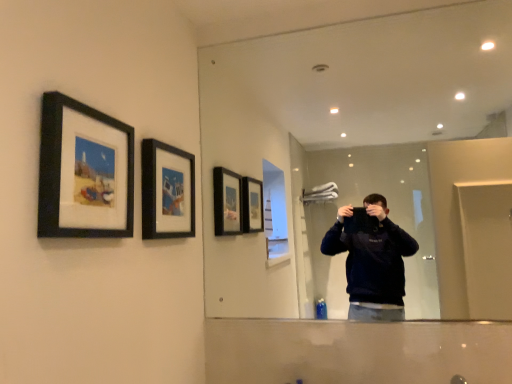
Measure the distance between point (91, 125) and camera.

Point (91, 125) is 1.00 meters from camera.

Where is `black matte picture frame at upper center, which ranks as the 2th picture frame in left-to-right order`? The width and height of the screenshot is (512, 384). black matte picture frame at upper center, which ranks as the 2th picture frame in left-to-right order is located at coordinates (167, 191).

At what (x,y) coordinates should I click in order to perform the action: click on clear glass mirror at upper center. Please return your answer as a coordinate pair (x, y). Looking at the image, I should click on coord(345,142).

Considering the positions of objects black matte picture frame at upper left, which is counted as the 1th picture frame, starting from the front, and clear glass mirror at upper center in the image provided, who is more to the left, black matte picture frame at upper left, which is counted as the 1th picture frame, starting from the front, or clear glass mirror at upper center?

From the viewer's perspective, black matte picture frame at upper left, which is counted as the 1th picture frame, starting from the front, appears more on the left side.

From the image's perspective, is black matte picture frame at upper left, which appears as the 2th picture frame when viewed from the back, above or below clear glass mirror at upper center?

black matte picture frame at upper left, which appears as the 2th picture frame when viewed from the back, is situated lower than clear glass mirror at upper center in the image.

From a real-world perspective, is black matte picture frame at upper left, arranged as the second picture frame when viewed from the right, on top of clear glass mirror at upper center?

No.

Is black matte picture frame at upper left, which is the first picture frame from left to right, taller than clear glass mirror at upper center?

No, black matte picture frame at upper left, which is the first picture frame from left to right, is not taller than clear glass mirror at upper center.

From a real-world perspective, does black matte picture frame at upper center, marked as the first picture frame in a right-to-left arrangement, stand above clear glass mirror at upper center?

No, from a real-world perspective, black matte picture frame at upper center, marked as the first picture frame in a right-to-left arrangement, is not over clear glass mirror at upper center

What's the angular difference between black matte picture frame at upper center, the first picture frame positioned from the back, and clear glass mirror at upper center's facing directions?

90.8 degrees separate the facing orientations of black matte picture frame at upper center, the first picture frame positioned from the back, and clear glass mirror at upper center.

Does black matte picture frame at upper center, which ranks as the 2th picture frame in left-to-right order, touch clear glass mirror at upper center?

They are not placed beside each other.

Considering the positions of objects black matte picture frame at upper center, the first picture frame positioned from the back, and clear glass mirror at upper center in the image provided, who is behind, black matte picture frame at upper center, the first picture frame positioned from the back, or clear glass mirror at upper center?

clear glass mirror at upper center is behind.

In the scene shown: How far apart are clear glass mirror at upper center and black matte picture frame at upper center, which is counted as the second picture frame, starting from the front?

clear glass mirror at upper center is 1.49 meters from black matte picture frame at upper center, which is counted as the second picture frame, starting from the front.

In terms of width, does clear glass mirror at upper center look wider or thinner when compared to black matte picture frame at upper center, which is counted as the second picture frame, starting from the front?

Clearly, clear glass mirror at upper center has less width compared to black matte picture frame at upper center, which is counted as the second picture frame, starting from the front.

From a real-world perspective, is clear glass mirror at upper center under black matte picture frame at upper center, marked as the first picture frame in a right-to-left arrangement?

No.

Is clear glass mirror at upper center oriented away from black matte picture frame at upper center, which ranks as the 2th picture frame in left-to-right order?

clear glass mirror at upper center does not have its back to black matte picture frame at upper center, which ranks as the 2th picture frame in left-to-right order.

Considering the relative sizes of black matte picture frame at upper center, marked as the first picture frame in a right-to-left arrangement, and black matte picture frame at upper left, arranged as the second picture frame when viewed from the right, in the image provided, is black matte picture frame at upper center, marked as the first picture frame in a right-to-left arrangement, shorter than black matte picture frame at upper left, arranged as the second picture frame when viewed from the right,?

Yes, black matte picture frame at upper center, marked as the first picture frame in a right-to-left arrangement, is shorter than black matte picture frame at upper left, arranged as the second picture frame when viewed from the right.

Does point (166, 232) come behind point (101, 149)?

Yes, point (166, 232) is farther from viewer.

From the image's perspective, is black matte picture frame at upper center, marked as the first picture frame in a right-to-left arrangement, located above black matte picture frame at upper left, which is counted as the 1th picture frame, starting from the front?

Actually, black matte picture frame at upper center, marked as the first picture frame in a right-to-left arrangement, appears below black matte picture frame at upper left, which is counted as the 1th picture frame, starting from the front, in the image.

At what (x,y) coordinates should I click in order to perform the action: click on mirror behind the black matte picture frame at upper left, which appears as the 2th picture frame when viewed from the back. Please return your answer as a coordinate pair (x, y). Looking at the image, I should click on (345, 142).

Is clear glass mirror at upper center closer to the viewer compared to black matte picture frame at upper left, which appears as the 2th picture frame when viewed from the back?

No, it is not.

Looking at the image, does clear glass mirror at upper center seem bigger or smaller compared to black matte picture frame at upper left, which is counted as the 1th picture frame, starting from the front?

Clearly, clear glass mirror at upper center is larger in size than black matte picture frame at upper left, which is counted as the 1th picture frame, starting from the front.

Could you tell me if clear glass mirror at upper center is facing black matte picture frame at upper left, which is the first picture frame from left to right?

Yes.

Is black matte picture frame at upper left, which is counted as the 1th picture frame, starting from the front, further to camera compared to black matte picture frame at upper center, marked as the first picture frame in a right-to-left arrangement?

No, the depth of black matte picture frame at upper left, which is counted as the 1th picture frame, starting from the front, is less than that of black matte picture frame at upper center, marked as the first picture frame in a right-to-left arrangement.

In the scene shown: From a real-world perspective, does black matte picture frame at upper left, which is counted as the 1th picture frame, starting from the front, sit lower than black matte picture frame at upper center, which is counted as the second picture frame, starting from the front?

No, from a real-world perspective, black matte picture frame at upper left, which is counted as the 1th picture frame, starting from the front, is not below black matte picture frame at upper center, which is counted as the second picture frame, starting from the front.

Could you measure the distance between black matte picture frame at upper left, arranged as the second picture frame when viewed from the right, and black matte picture frame at upper center, which ranks as the 2th picture frame in left-to-right order?

black matte picture frame at upper left, arranged as the second picture frame when viewed from the right, and black matte picture frame at upper center, which ranks as the 2th picture frame in left-to-right order, are 8.90 inches apart from each other.

Does point (70, 177) lie behind point (174, 212)?

No.

You are a GUI agent. You are given a task and a screenshot of the screen. Output one action in this format:
    pyautogui.click(x=<x>, y=<y>)
    Task: Click on the 2nd picture frame in front of the clear glass mirror at upper center, counting from the anchor's position
    
    Given the screenshot: What is the action you would take?
    pyautogui.click(x=82, y=171)

Identify the location of the 1st picture frame to the left when counting from the clear glass mirror at upper center. The width and height of the screenshot is (512, 384). (167, 191).

Based on their spatial positions, is black matte picture frame at upper left, which is counted as the 1th picture frame, starting from the front, or clear glass mirror at upper center further from black matte picture frame at upper center, which is counted as the second picture frame, starting from the front?

The object further to black matte picture frame at upper center, which is counted as the second picture frame, starting from the front, is clear glass mirror at upper center.

Considering their positions, is black matte picture frame at upper left, which appears as the 2th picture frame when viewed from the back, positioned further to clear glass mirror at upper center than black matte picture frame at upper center, which ranks as the 2th picture frame in left-to-right order?

black matte picture frame at upper left, which appears as the 2th picture frame when viewed from the back, is positioned further to the anchor clear glass mirror at upper center.

Considering their positions, is clear glass mirror at upper center positioned closer to black matte picture frame at upper center, marked as the first picture frame in a right-to-left arrangement, than black matte picture frame at upper left, which appears as the 2th picture frame when viewed from the back?

The object closer to black matte picture frame at upper center, marked as the first picture frame in a right-to-left arrangement, is black matte picture frame at upper left, which appears as the 2th picture frame when viewed from the back.

Looking at the image, which one is located closer to clear glass mirror at upper center, black matte picture frame at upper center, which is counted as the second picture frame, starting from the front, or black matte picture frame at upper left, which is counted as the 1th picture frame, starting from the front?

black matte picture frame at upper center, which is counted as the second picture frame, starting from the front, is closer to clear glass mirror at upper center.

Looking at the image, which one is located closer to black matte picture frame at upper left, arranged as the second picture frame when viewed from the right, clear glass mirror at upper center or black matte picture frame at upper center, marked as the first picture frame in a right-to-left arrangement?

black matte picture frame at upper center, marked as the first picture frame in a right-to-left arrangement, is positioned closer to the anchor black matte picture frame at upper left, arranged as the second picture frame when viewed from the right.

From the image, which object appears to be farther from black matte picture frame at upper left, which is the first picture frame from left to right, black matte picture frame at upper center, the first picture frame positioned from the back, or clear glass mirror at upper center?

Based on the image, clear glass mirror at upper center appears to be further to black matte picture frame at upper left, which is the first picture frame from left to right.

The width and height of the screenshot is (512, 384). Find the location of `picture frame between black matte picture frame at upper left, which appears as the 2th picture frame when viewed from the back, and clear glass mirror at upper center, in the horizontal direction`. picture frame between black matte picture frame at upper left, which appears as the 2th picture frame when viewed from the back, and clear glass mirror at upper center, in the horizontal direction is located at coordinates (167, 191).